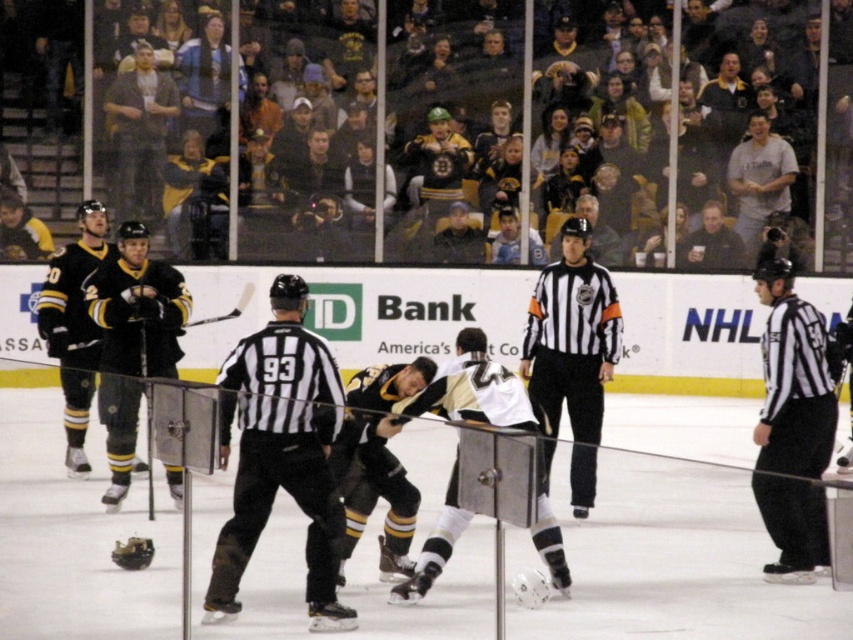
You are a spectator at the ice hockey game and want to take a photo of the gray cotton shirt at upper right and the black matte hockey stick at left. Which object should you zoom in on to capture both in the frame without moving your camera?

The gray cotton shirt at upper right is bigger than the black matte hockey stick at left, so you should zoom in on the smaller object, the black matte hockey stick at left, to include both in the frame.

You are a spectator at the ice hockey game and want to take a photo of both the white jersey at center and the dark brown leather jacket at upper center. Which one should you focus on first to ensure both are in frame?

The white jersey at center is located below the dark brown leather jacket at upper center, so you should focus on the dark brown leather jacket at upper center first to ensure both are in frame.